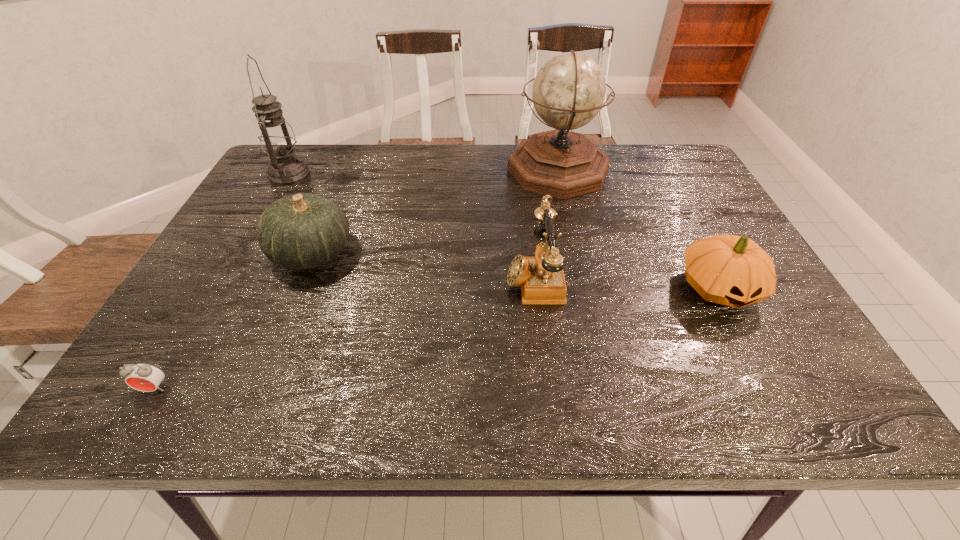
The height and width of the screenshot is (540, 960). I want to click on gourd at the left edge, so click(301, 231).

I want to click on alarm clock situated at the left edge, so click(x=144, y=377).

At what (x,y) coordinates should I click in order to perform the action: click on object that is positioned at the right edge. Please return your answer as a coordinate pair (x, y). This screenshot has height=540, width=960. Looking at the image, I should click on (731, 270).

You are a GUI agent. You are given a task and a screenshot of the screen. Output one action in this format:
    pyautogui.click(x=<x>, y=<y>)
    Task: Click on the object that is at the far left corner
    
    Given the screenshot: What is the action you would take?
    pyautogui.click(x=277, y=138)

Identify the location of object situated at the near left corner. (144, 377).

In the image, there is a desktop. What are the coordinates of `vacant space at the far edge` in the screenshot? It's located at (455, 161).

In the image, there is a desktop. Where is `free region at the near edge`? free region at the near edge is located at coordinates (362, 386).

Locate an element on the screen. The image size is (960, 540). vacant space at the left edge of the desktop is located at coordinates (212, 260).

Locate an element on the screen. Image resolution: width=960 pixels, height=540 pixels. free spot at the right edge of the desktop is located at coordinates (723, 306).

Find the location of a particular element. vacant space at the near right corner is located at coordinates (829, 382).